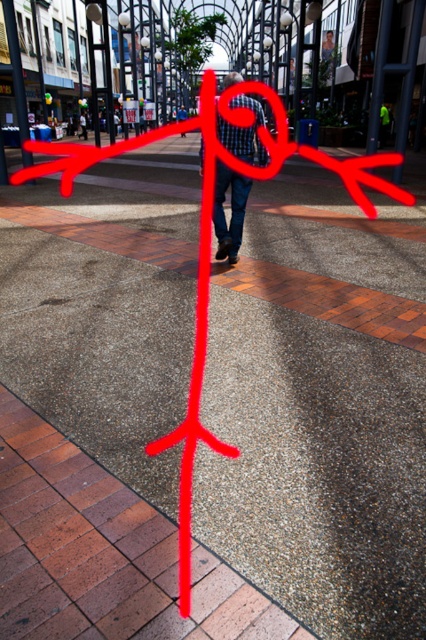
How far apart are checkered fabric shirt at center and metallic pole at upper center?

checkered fabric shirt at center is 28.62 feet away from metallic pole at upper center.

Is checkered fabric shirt at center positioned before metallic pole at upper center?

That is True.

I want to click on checkered fabric shirt at center, so click(232, 211).

Image resolution: width=426 pixels, height=640 pixels. Identify the location of checkered fabric shirt at center. (232, 211).

Is denim jeans at center smaller than denim pants at center?

Yes, denim jeans at center is smaller than denim pants at center.

Is denim jeans at center taller than denim pants at center?

Incorrect, denim jeans at center's height is not larger of denim pants at center's.

You are a GUI agent. You are given a task and a screenshot of the screen. Output one action in this format:
    pyautogui.click(x=<x>, y=<y>)
    Task: Click on the denim jeans at center
    The height and width of the screenshot is (640, 426).
    Given the screenshot: What is the action you would take?
    pyautogui.click(x=83, y=124)

Does point (224, 228) come closer to viewer compared to point (183, 113)?

Yes.

Can you confirm if checkered fabric shirt at center is positioned to the left of denim pants at center?

In fact, checkered fabric shirt at center is to the right of denim pants at center.

Who is more distant from viewer, (242, 108) or (181, 134)?

The point (181, 134) is more distant.

Find the location of a particular element. checkered fabric shirt at center is located at coordinates (232, 211).